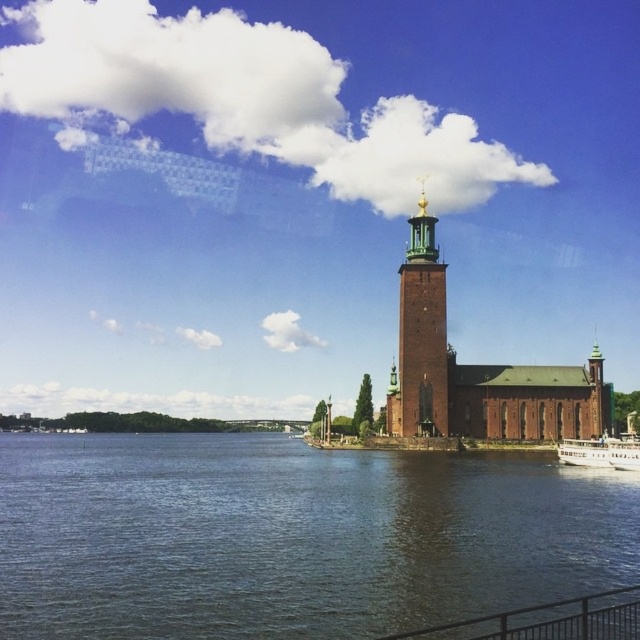
You are a tourist standing at the waterfront in front of Stockholm City Hall. You see the red brick tower at center and the white wooden boat at lower right. Which object is taller?

The red brick tower at center is much taller than the white wooden boat at lower right.

You are standing in front of Stockholm City Hall and notice the dark blue water at center and the brown brick church at center. Which object is positioned to the left of the other?

The dark blue water at center is to the left of the brown brick church at center.

You are standing in front of Stockholm City Hall and want to take a photo. You notice two points marked on the ground at coordinates point (536, 605) and point (604, 444). If you want to ensure both points are visible in the photo, which point should be closer to the camera?

Point (536, 605) is in front of point (604, 444), so to ensure both are visible, the point closer to the camera should be point (536, 605).